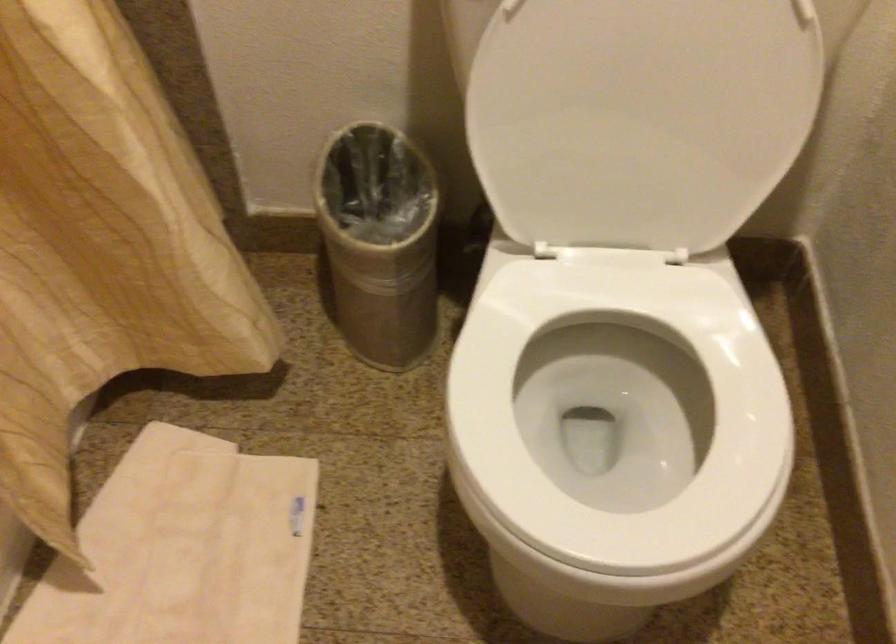
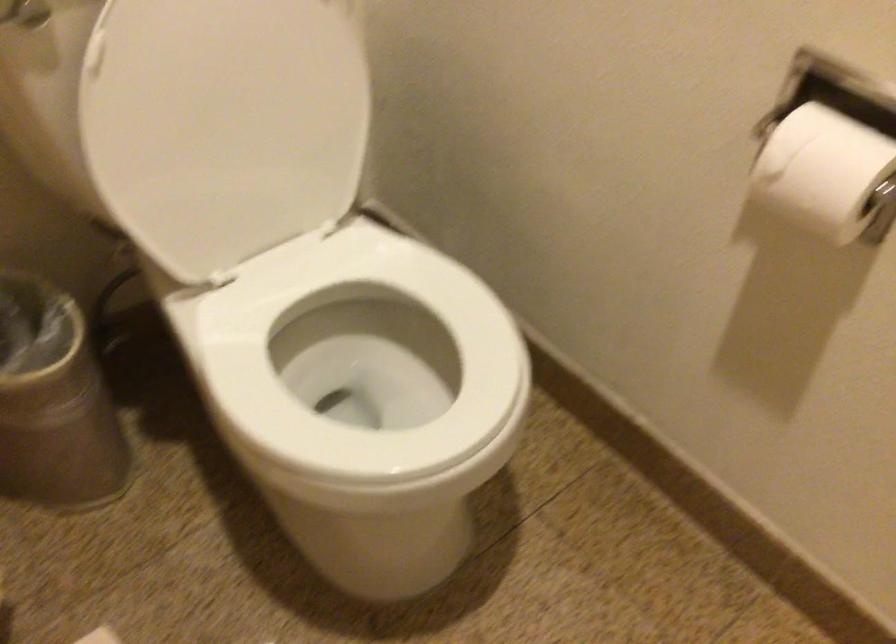
Locate, in the second image, the point that corresponds to the point at 368,272 in the first image.

(54, 402)